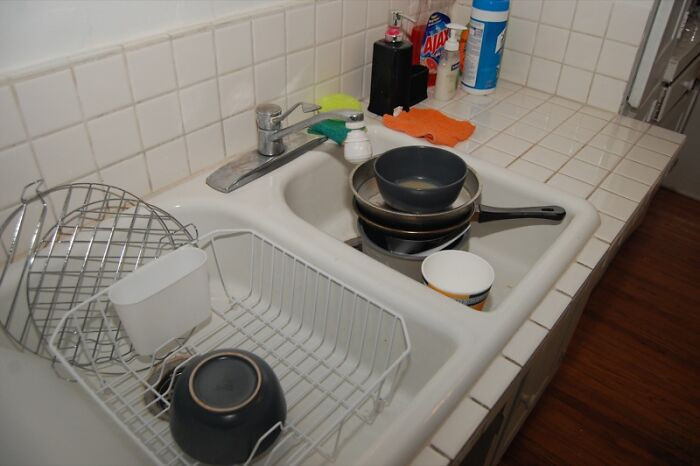
Find the location of a particular element. The height and width of the screenshot is (466, 700). white sink is located at coordinates (274, 208).